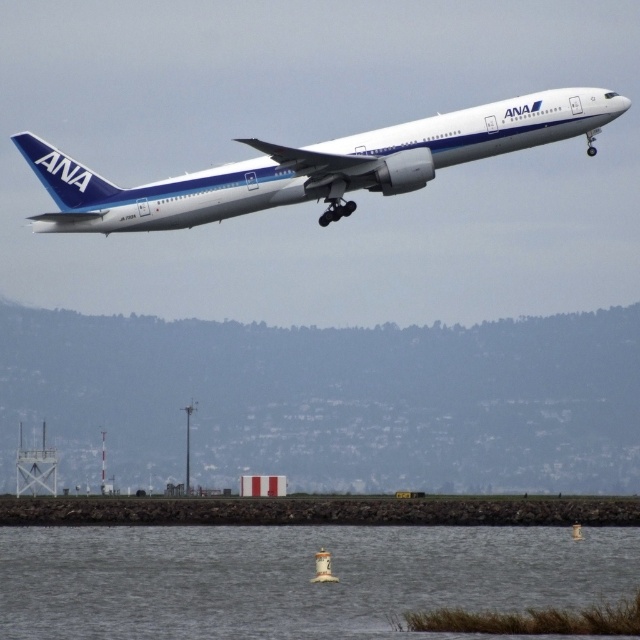
Is gray water at lower center positioned behind white metallic airplane at center?

No, it is not.

Is gray water at lower center smaller than white metallic airplane at center?

Correct, gray water at lower center occupies less space than white metallic airplane at center.

Locate an element on the screen. This screenshot has width=640, height=640. gray water at lower center is located at coordinates (296, 577).